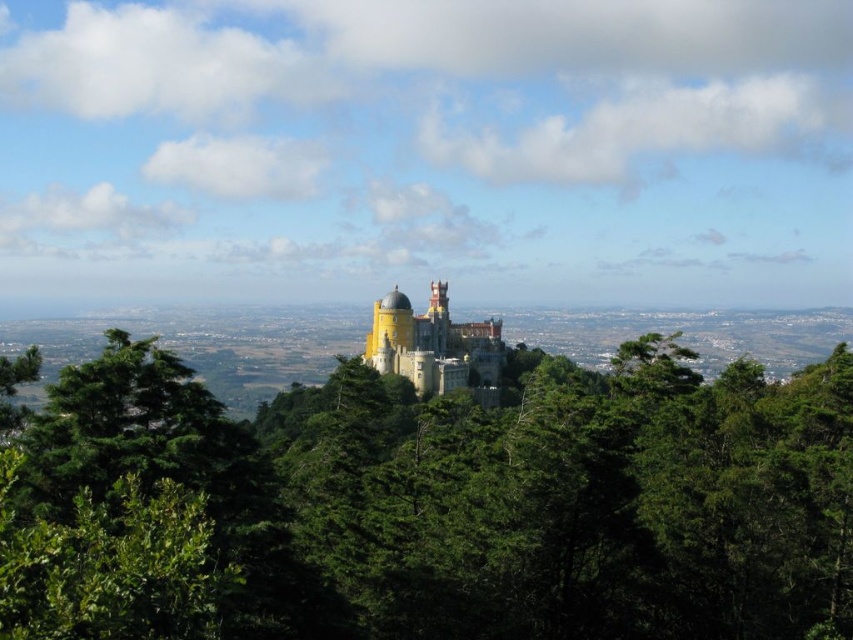
Does green leafy tree at center have a lesser width compared to yellow matte castle at center?

Incorrect, green leafy tree at center's width is not less than yellow matte castle at center's.

Between green leafy tree at center and yellow matte castle at center, which one has less height?

With less height is yellow matte castle at center.

Where is `green leafy tree at center`? green leafy tree at center is located at coordinates (492, 493).